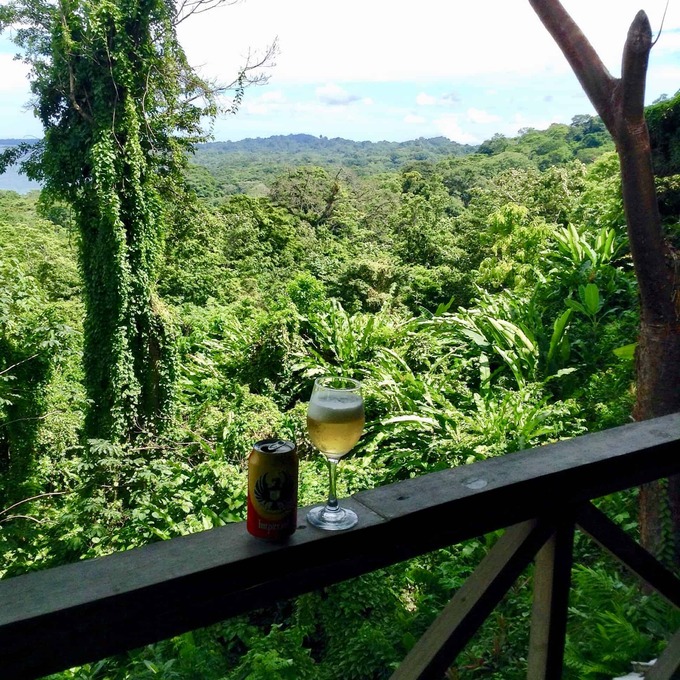
In order to click on base of wine glass in this screenshot , I will do `click(333, 524)`.